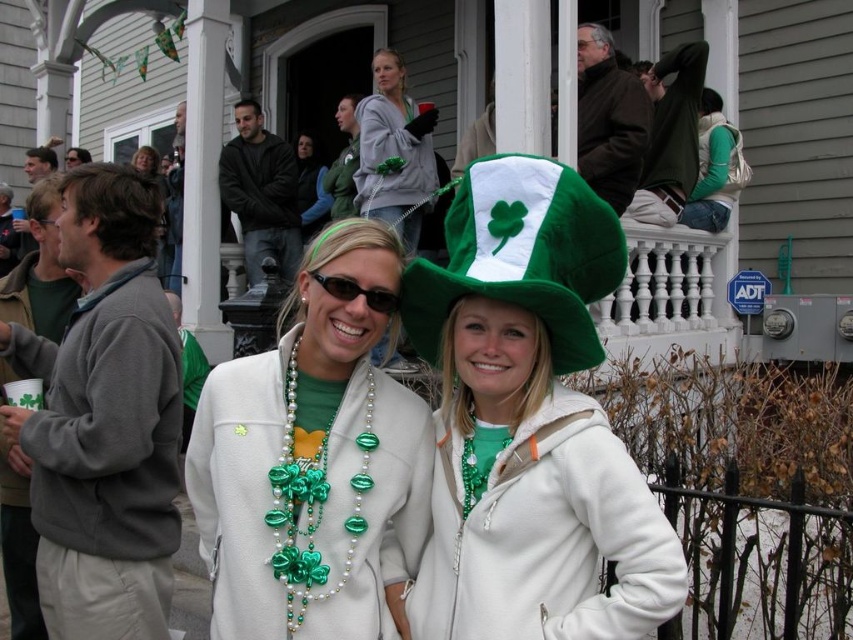
Question: Which of the following is the farthest from the observer?

Choices:
 (A) green beaded necklace at center
 (B) matte green hat at upper center
 (C) green felt hat at center
 (D) gray fleece sweatshirt at left

Answer: (B)

Question: Does green beaded necklace with shamrocks at center come in front of green fabric vest at upper center?

Choices:
 (A) yes
 (B) no

Answer: (A)

Question: Which is farther from the green felt hat at center?

Choices:
 (A) black plastic sunglasses at center
 (B) green beaded necklace at center
 (C) green beaded necklace with shamrocks at center
 (D) green fuzzy hat at center

Answer: (A)

Question: Based on their relative distances, which object is farther from the green beaded necklace with shamrocks at center?

Choices:
 (A) green felt hat at center
 (B) green fuzzy hat at center
 (C) green fabric vest at upper center
 (D) green matte necklace at center

Answer: (C)

Question: Considering the relative positions of green felt hat at center and matte green hat at upper center in the image provided, where is green felt hat at center located with respect to matte green hat at upper center?

Choices:
 (A) left
 (B) right

Answer: (B)

Question: Can you confirm if green felt hat at center is thinner than green fabric vest at upper center?

Choices:
 (A) yes
 (B) no

Answer: (B)